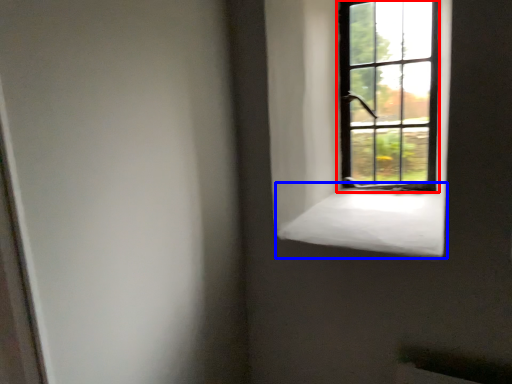
Question: Which object is further to the camera taking this photo, window (highlighted by a red box) or window sill (highlighted by a blue box)?

Choices:
 (A) window
 (B) window sill

Answer: (A)